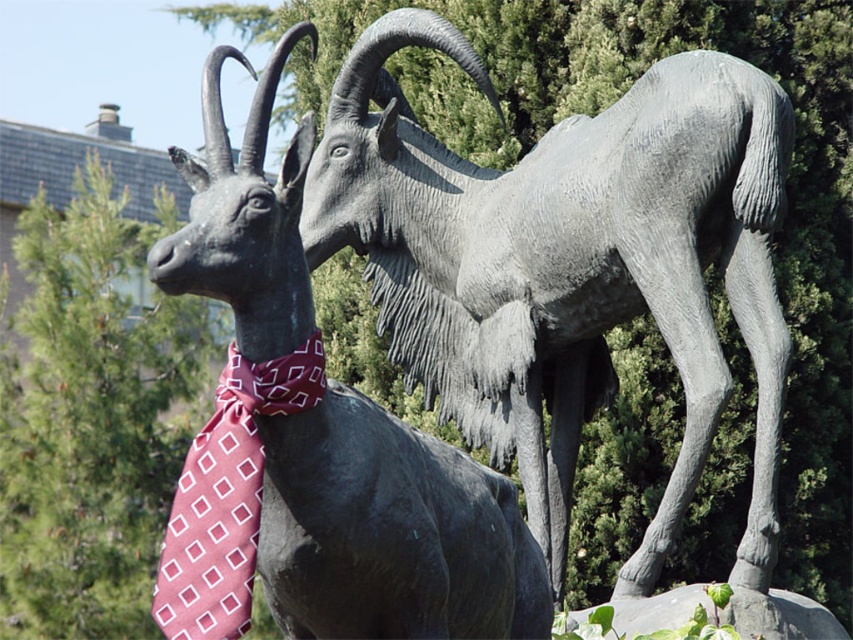
Question: Which object appears closest to the camera in this image?

Choices:
 (A) matte black goat at center
 (B) maroon silk tie at center

Answer: (A)

Question: Which point is farther to the camera?

Choices:
 (A) maroon silk tie at center
 (B) matte black goat at center
 (C) matte gray goat at center

Answer: (C)

Question: Which point is closer to the camera?

Choices:
 (A) matte gray goat at center
 (B) maroon silk tie at center
 (C) matte black goat at center

Answer: (C)

Question: Where is matte gray goat at center located in relation to matte black goat at center in the image?

Choices:
 (A) right
 (B) left

Answer: (A)

Question: Can you confirm if matte gray goat at center is wider than maroon silk tie at center?

Choices:
 (A) yes
 (B) no

Answer: (B)

Question: Is matte black goat at center thinner than maroon silk tie at center?

Choices:
 (A) yes
 (B) no

Answer: (A)